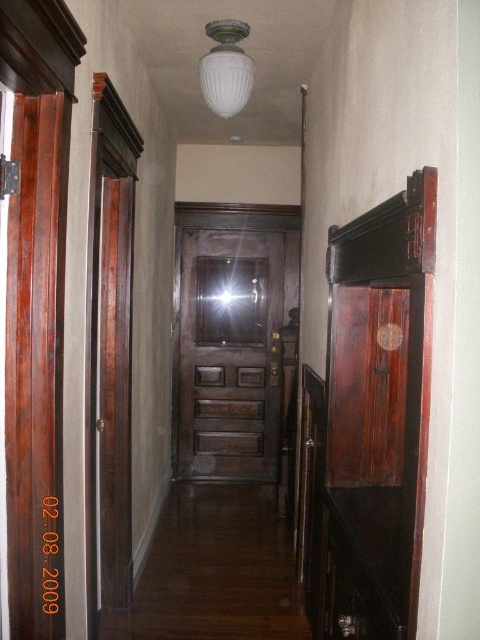
You are a delivery person trying to deliver a package to the apartment. The package is too large to fit through the doorway. You notice the dark wood door at center and the white frosted glass light fixture at upper center. Which object is bigger and could potentially block the package from passing through?

The dark wood door at center is larger in size than the white frosted glass light fixture at upper center, so the dark wood door at center is bigger and could potentially block the package from passing through.

You are moving a large painting that is 1.2 meters wide. You want to hang it on the wall between the dark wood door at center and the mahogany wood door at left. Can the painting fit between them?

The dark wood door at center is wider than the mahogany wood door at left. Therefore, the space between them may be sufficient for the painting, but the exact distance isn